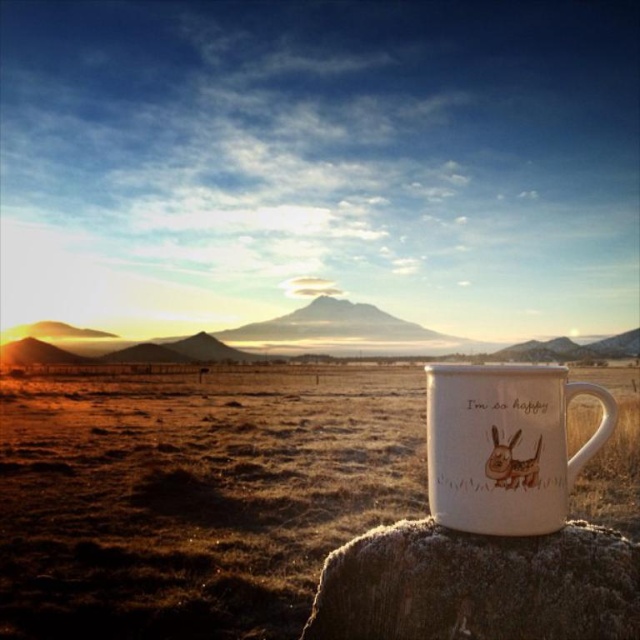
You are standing in the landscape scene and want to place a small decorative stone on the exact spot where the white matte cup at center is located. The coordinates of this spot are given as point (x=195, y=497). Can you confirm if this location is suitable for placing the stone without obstructing the view of the horizon?

The white matte cup at center is located at point (x=195, y=497), which is in the foreground of the scene. Placing a small decorative stone there would not obstruct the view of the horizon since the foreground elements are separate from the sky and horizon area.